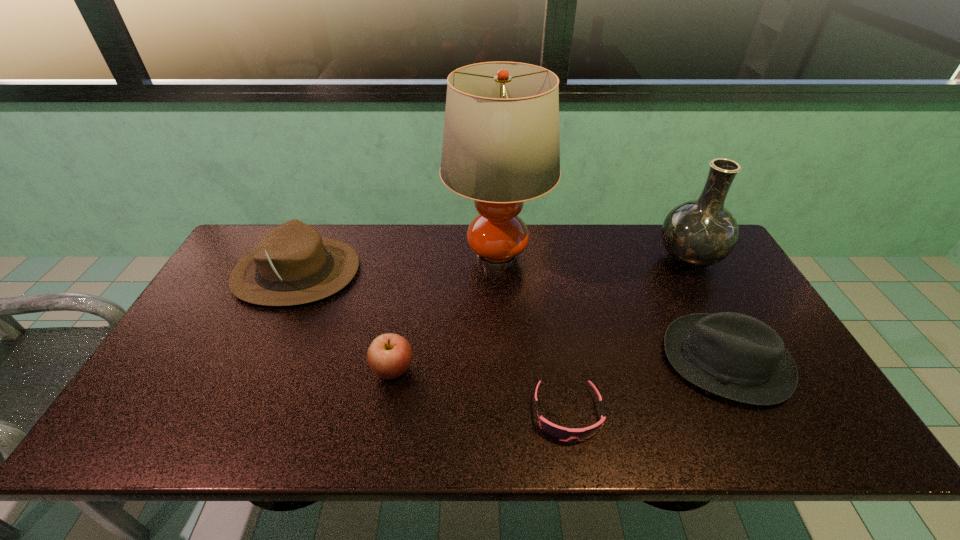
Image resolution: width=960 pixels, height=540 pixels. I want to click on blank space located on the feather side of the farther fedora, so click(x=457, y=272).

The image size is (960, 540). What are the coordinates of `vacant space located on the back of the nearer fedora` in the screenshot? It's located at (675, 262).

Locate an element on the screen. The height and width of the screenshot is (540, 960). vacant space located 0.400m on the right of the apple is located at coordinates (572, 369).

At what (x,y) coordinates should I click in order to perform the action: click on lamp that is at the far edge. Please return your answer as a coordinate pair (x, y). The height and width of the screenshot is (540, 960). Looking at the image, I should click on 501,147.

Locate an element on the screen. Image resolution: width=960 pixels, height=540 pixels. vase situated at the far edge is located at coordinates (699, 233).

You are a GUI agent. You are given a task and a screenshot of the screen. Output one action in this format:
    pyautogui.click(x=<x>, y=<y>)
    Task: Click on the fedora that is at the far edge
    This screenshot has width=960, height=540.
    Given the screenshot: What is the action you would take?
    pyautogui.click(x=292, y=265)

Identify the location of object that is at the near edge. Image resolution: width=960 pixels, height=540 pixels. (561, 433).

Locate an element on the screen. The width and height of the screenshot is (960, 540). object that is at the left edge is located at coordinates (292, 265).

Find the location of a particular element. The image size is (960, 540). vase that is at the right edge is located at coordinates (699, 233).

At what (x,y) coordinates should I click in order to perform the action: click on fedora that is at the right edge. Please return your answer as a coordinate pair (x, y). This screenshot has height=540, width=960. Looking at the image, I should click on (735, 356).